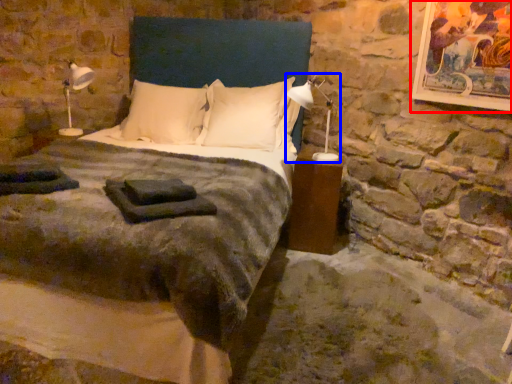
Question: Which object is closer to the camera taking this photo, picture frame (highlighted by a red box) or bedside lamp (highlighted by a blue box)?

Choices:
 (A) picture frame
 (B) bedside lamp

Answer: (A)